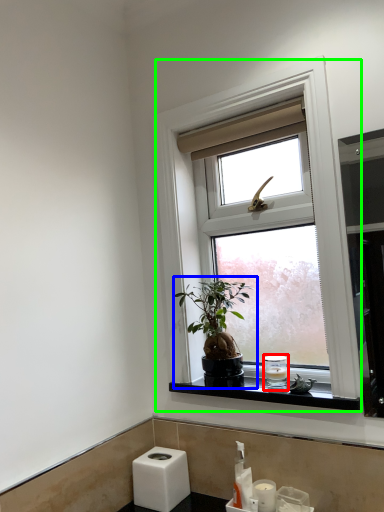
Question: Based on their relative distances, which object is farther from toiletry (highlighted by a red box)? Choose from houseplant (highlighted by a blue box) and window (highlighted by a green box).

Choices:
 (A) houseplant
 (B) window

Answer: (B)